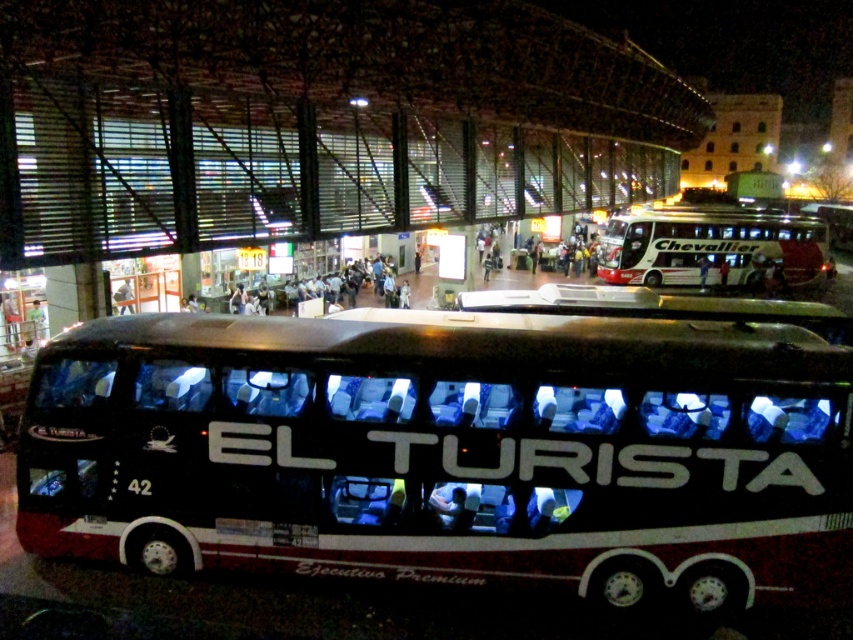
Based on the photo, you are a bus driver who needs to park your vehicle in a tight space at the terminal. You see the black matte bus at center and the white glossy bus at upper right. Which bus would be easier to maneuver into a narrow parking spot?

The black matte bus at center occupies less space than the white glossy bus at upper right, so it would be easier to maneuver into a narrow parking spot.

You are standing at the bus terminal and want to board the black matte bus at center. There is a white glossy bus at upper right blocking your path. Can you walk around it easily?

The black matte bus at center is closer to the viewer than the white glossy bus at upper right, so you can easily walk around the white glossy bus at upper right to reach the black matte bus at center.